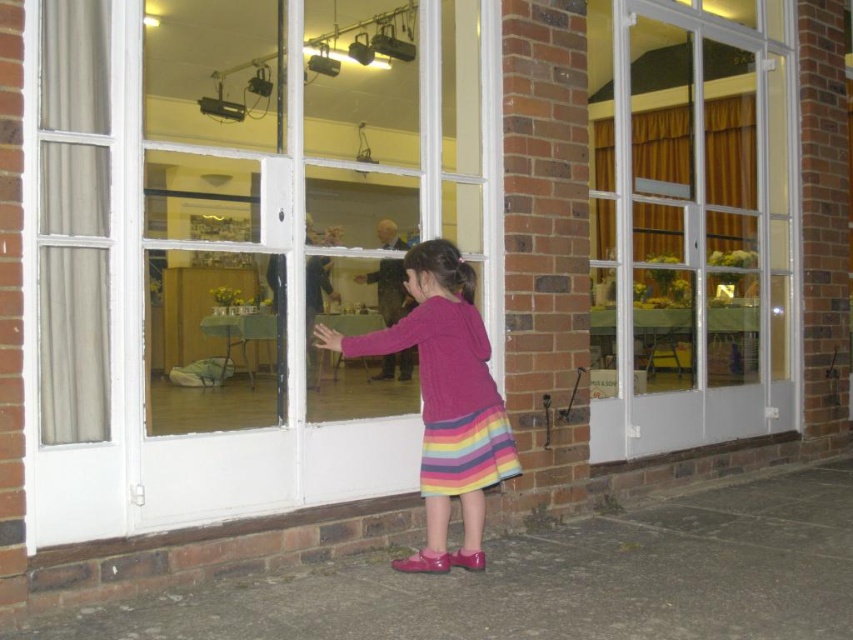
Question: Is transparent glass door at center positioned in front of knitted pink sweater at center?

Choices:
 (A) yes
 (B) no

Answer: (A)

Question: Is the position of transparent glass door at center less distant than that of knitted pink sweater at center?

Choices:
 (A) yes
 (B) no

Answer: (A)

Question: Among these objects, which one is farthest from the camera?

Choices:
 (A) knitted pink sweater at center
 (B) transparent glass door at center

Answer: (A)

Question: Considering the real-world distances, which object is closest to the transparent glass door at center?

Choices:
 (A) clear glass door at center
 (B) knitted pink sweater at center

Answer: (B)

Question: Which object appears farthest from the camera in this image?

Choices:
 (A) knitted pink sweater at center
 (B) clear glass door at center
 (C) transparent glass door at center

Answer: (B)

Question: Is clear glass door at center in front of knitted pink sweater at center?

Choices:
 (A) yes
 (B) no

Answer: (B)